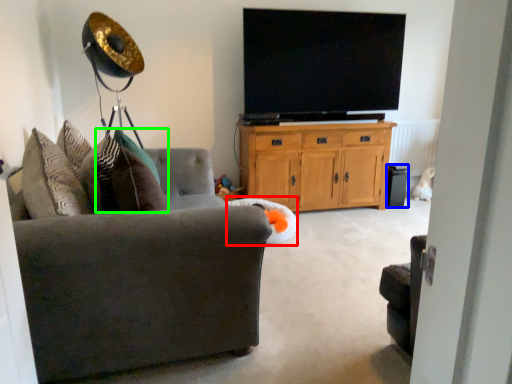
Question: Considering the real-world distances, which object is closest to bean bag chair (highlighted by a red box)? speaker (highlighted by a blue box) or pillow (highlighted by a green box).

Choices:
 (A) speaker
 (B) pillow

Answer: (B)